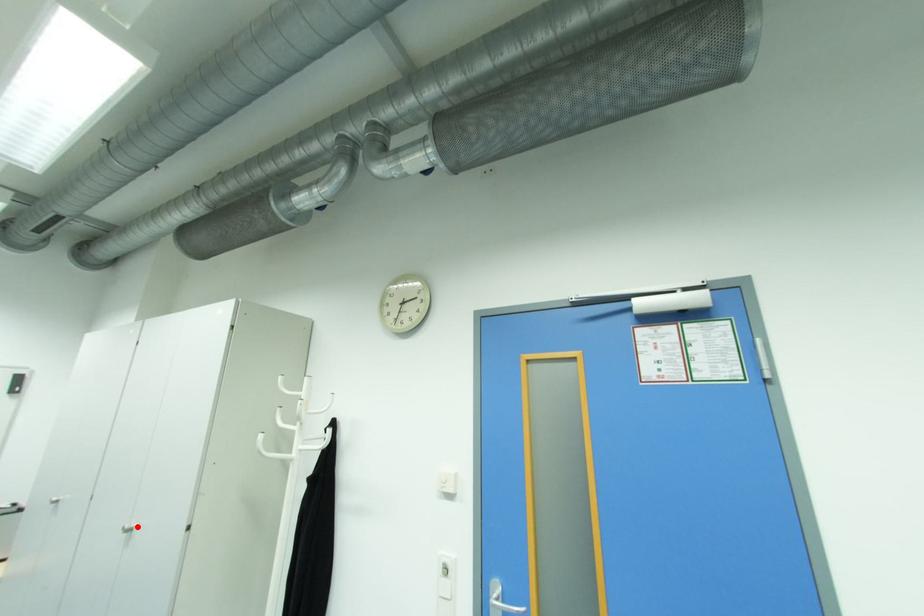
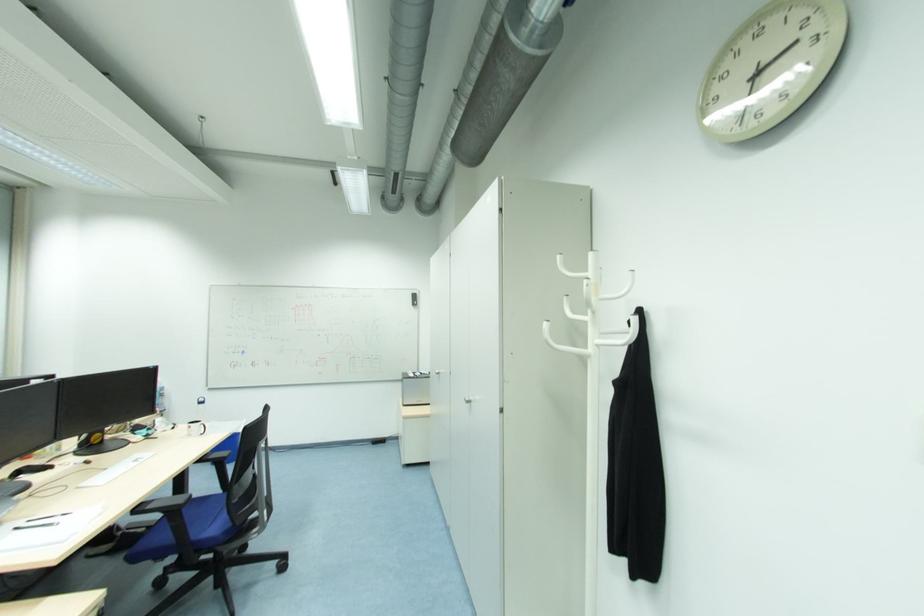
Question: I am providing you with two images of the same scene from different viewpoints. A red point is shown in image1. For the corresponding object point in image2, is it positioned nearer or farther from the camera?

Choices:
 (A) Nearer
 (B) Farther

Answer: (B)